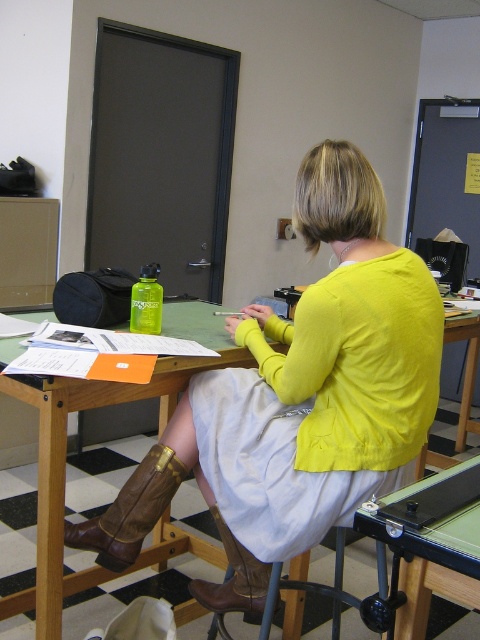
Question: Which point is closer to the camera?

Choices:
 (A) (137, 493)
 (B) (222, 529)

Answer: (B)

Question: Estimate the real-world distances between objects in this image. Which object is farther from the brown leather boot at lower left?

Choices:
 (A) matte yellow sweater at center
 (B) brown leather boot at lower center

Answer: (A)

Question: Is matte yellow sweater at center thinner than brown leather boot at lower center?

Choices:
 (A) no
 (B) yes

Answer: (A)

Question: From the image, what is the correct spatial relationship of matte yellow sweater at center in relation to brown leather boot at lower left?

Choices:
 (A) above
 (B) below

Answer: (A)

Question: Is matte yellow sweater at center bigger than brown leather boot at lower left?

Choices:
 (A) no
 (B) yes

Answer: (B)

Question: Which of the following is the farthest from the observer?

Choices:
 (A) (154, 486)
 (B) (210, 509)

Answer: (B)